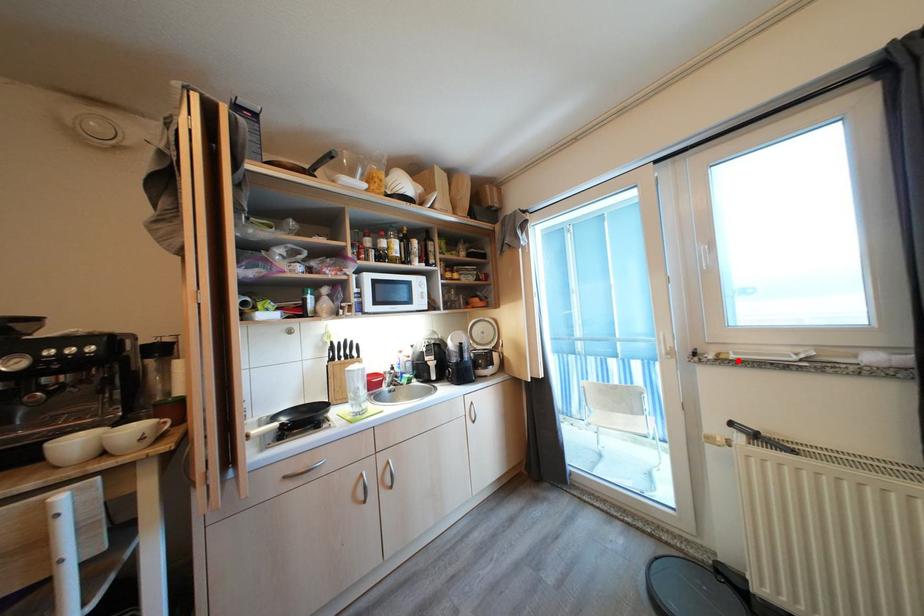
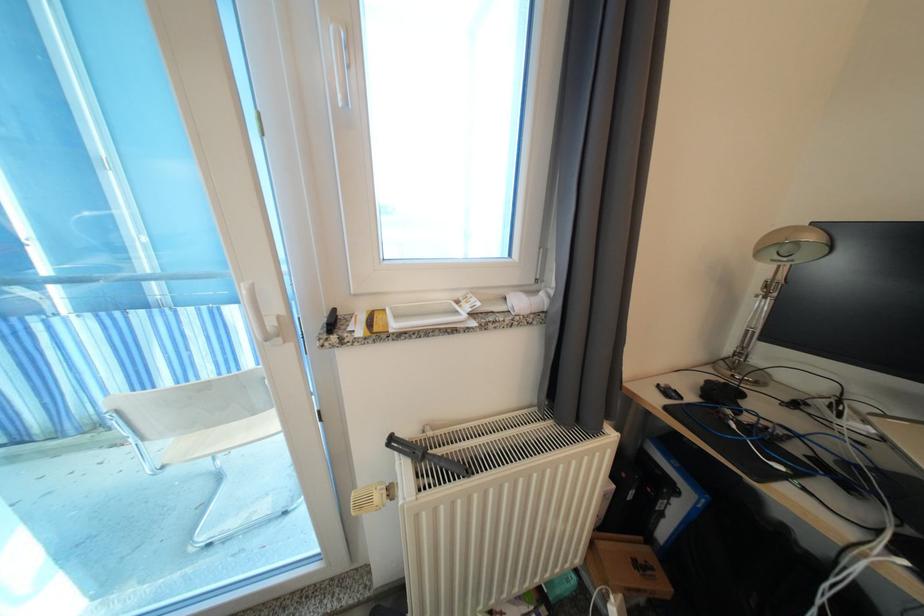
The point at the highlighted location is marked in the first image. Where is the corresponding point in the second image?

(398, 330)